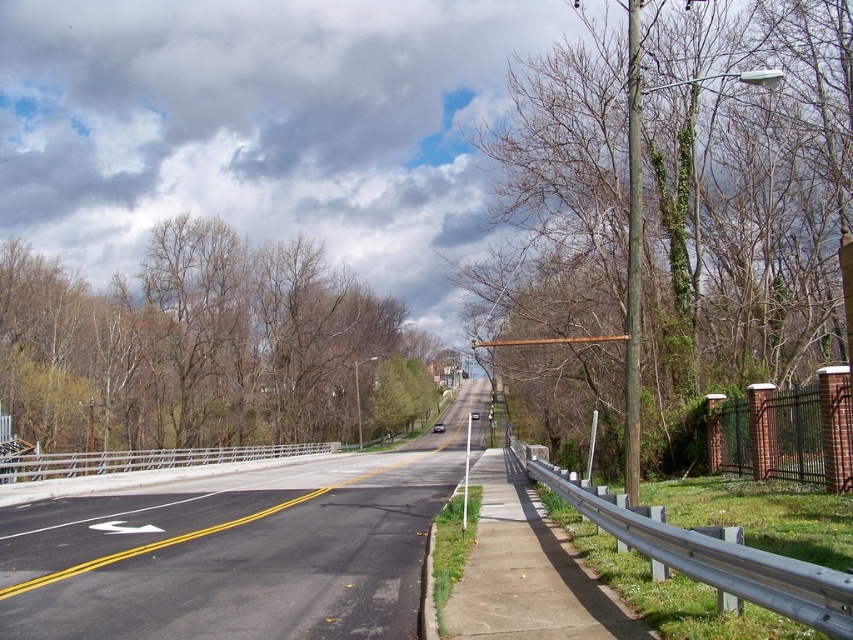
You are standing at the point marked by the coordinates (190,344) on the image, which corresponds to a specific location in the suburban street scene. Based on the scene description provided, what object are you directly standing on or near?

The point at coordinates (190,344) indicates the brown leafless tree at center, so you are directly standing on or near the brown leafless tree at center.

You are standing at the point with coordinates (682, 198) on the suburban street scene. What object are you standing on?

You are standing on the green ivy covered pole at right.